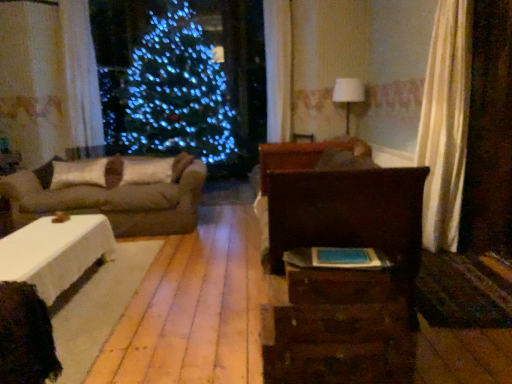
Question: Are rustic wood dresser at center and wooden drawer at lower right beside each other?

Choices:
 (A) no
 (B) yes

Answer: (B)

Question: From a real-world perspective, is rustic wood dresser at center positioned under wooden drawer at lower right based on gravity?

Choices:
 (A) yes
 (B) no

Answer: (A)

Question: Is rustic wood dresser at center at the left side of wooden drawer at lower right?

Choices:
 (A) no
 (B) yes

Answer: (B)

Question: Is rustic wood dresser at center shorter than wooden drawer at lower right?

Choices:
 (A) no
 (B) yes

Answer: (A)

Question: Does rustic wood dresser at center come in front of wooden drawer at lower right?

Choices:
 (A) yes
 (B) no

Answer: (A)

Question: Is beige fabric couch at left bigger or smaller than wooden drawer at lower right?

Choices:
 (A) big
 (B) small

Answer: (A)

Question: Visually, is beige fabric couch at left positioned to the left or to the right of wooden drawer at lower right?

Choices:
 (A) left
 (B) right

Answer: (A)

Question: Is beige fabric couch at left in front of or behind wooden drawer at lower right in the image?

Choices:
 (A) behind
 (B) front

Answer: (A)

Question: Is beige fabric couch at left wider or thinner than wooden drawer at lower right?

Choices:
 (A) thin
 (B) wide

Answer: (B)

Question: From a real-world perspective, is white fabric pillow at left, which is the second pillow from left to right, physically located above or below beige fabric couch at left?

Choices:
 (A) above
 (B) below

Answer: (A)

Question: Is white fabric pillow at left, which is the second pillow from left to right, in front of or behind beige fabric couch at left in the image?

Choices:
 (A) front
 (B) behind

Answer: (B)

Question: From their relative heights in the image, would you say white fabric pillow at left, which is the second pillow from left to right, is taller or shorter than beige fabric couch at left?

Choices:
 (A) short
 (B) tall

Answer: (A)

Question: In the image, is white fabric pillow at left, which is the second pillow from left to right, on the left side or the right side of beige fabric couch at left?

Choices:
 (A) left
 (B) right

Answer: (B)

Question: From the image's perspective, is rustic wood dresser at center positioned above or below white matte pillow at left, which is the 2th pillow from right to left?

Choices:
 (A) below
 (B) above

Answer: (A)

Question: Looking at their shapes, would you say rustic wood dresser at center is wider or thinner than white matte pillow at left, which is the 2th pillow from right to left?

Choices:
 (A) thin
 (B) wide

Answer: (B)